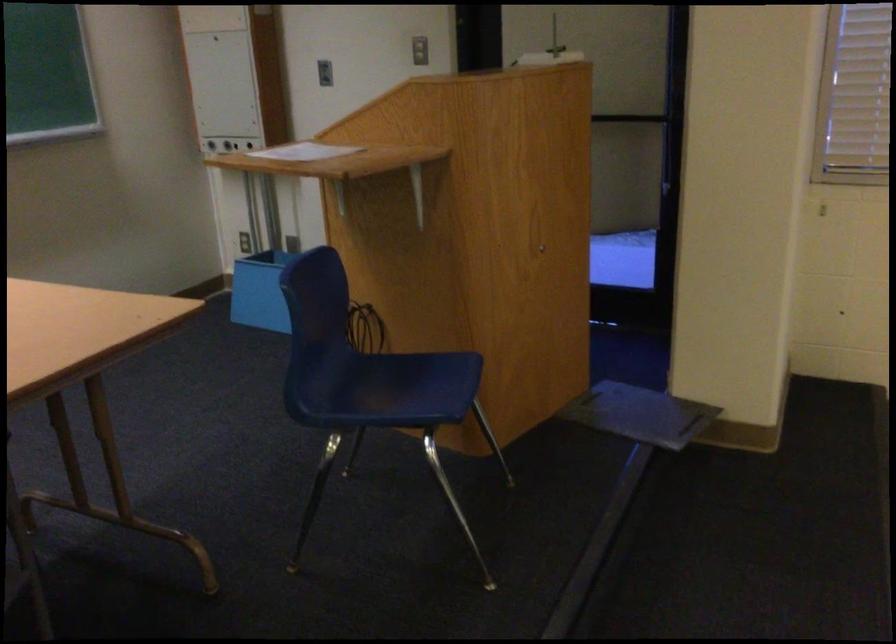
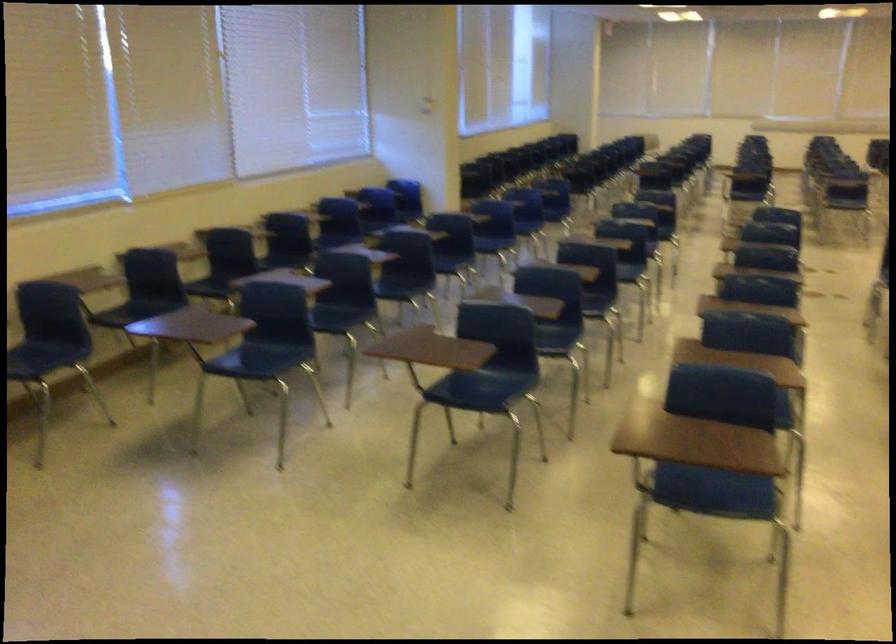
How did the camera likely rotate?

The rotation direction of the camera is right-down.